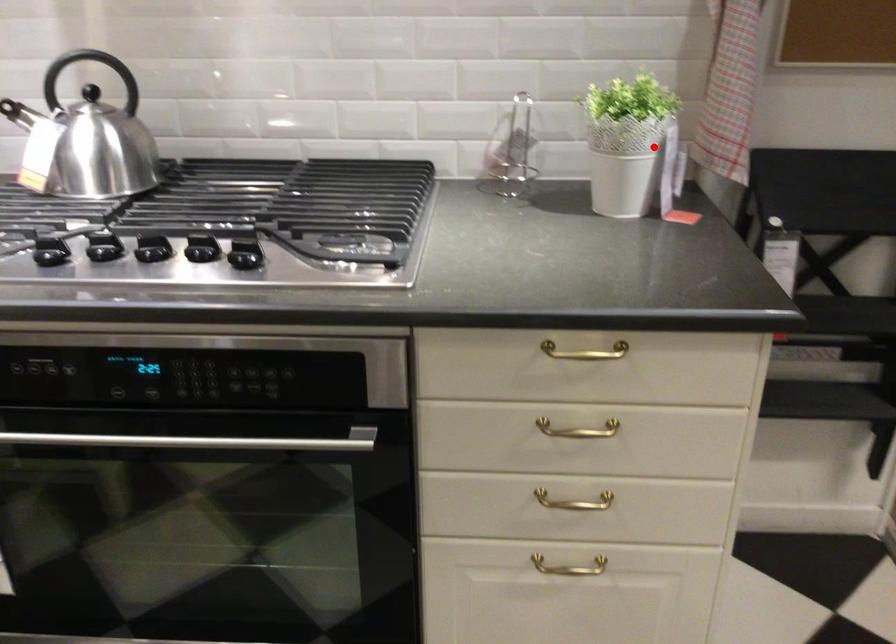
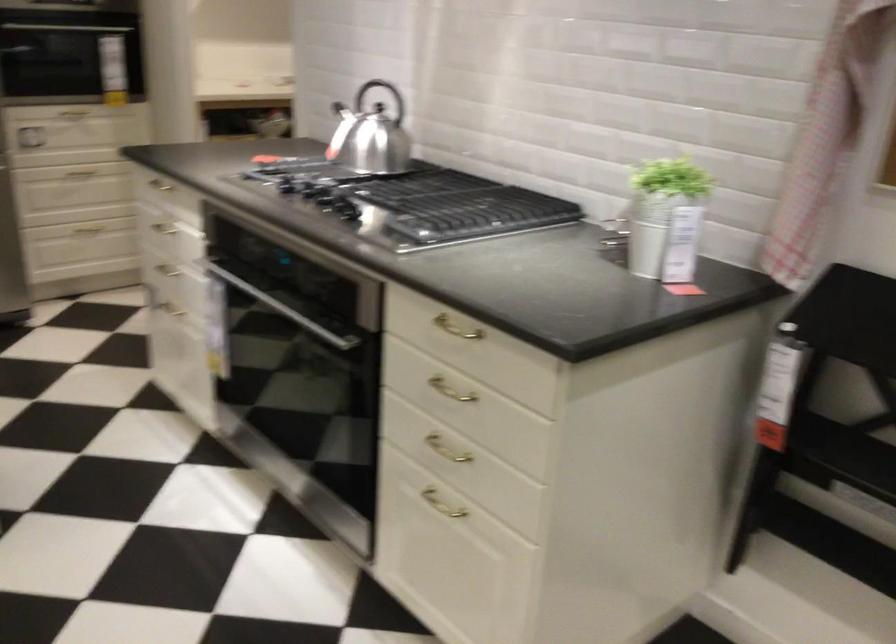
Question: I am providing you with two images of the same scene from different viewpoints. Image1 has a red point marked. In image2, the corresponding 3D location appears at what relative position? Reply with the corresponding letter.

Choices:
 (A) Closer
 (B) Farther

Answer: (B)